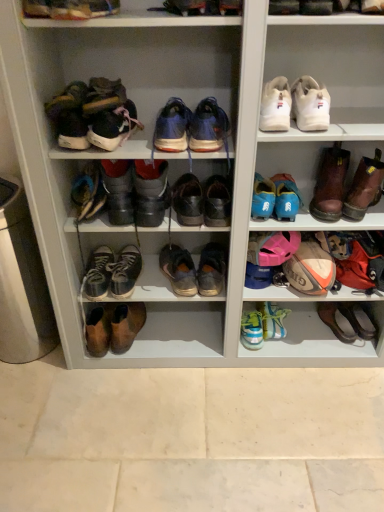
This screenshot has width=384, height=512. What are the coordinates of `blank area beneath worn leather shoes at center, placed as the 7th footwear when sorted from left to right (from a real-world perspective)` in the screenshot? It's located at (190, 330).